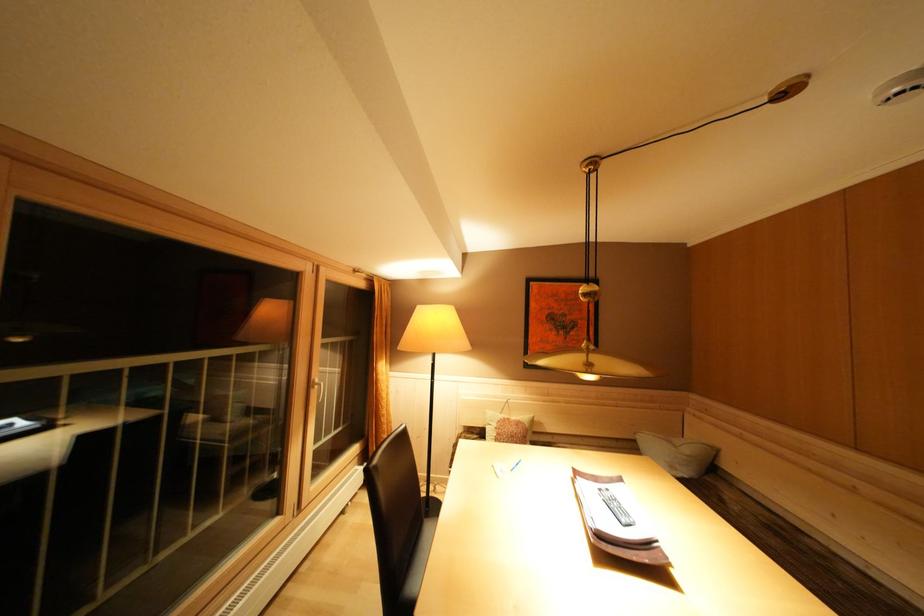
The width and height of the screenshot is (924, 616). Describe the element at coordinates (394, 484) in the screenshot. I see `the black chair sitting surface` at that location.